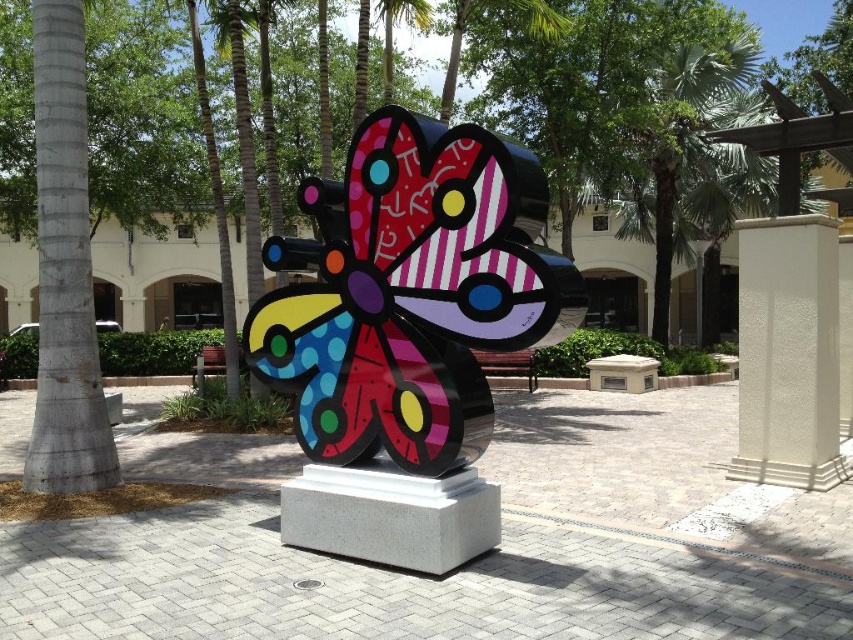
Question: Which of these objects is positioned closest to the smooth concrete pillar at left?

Choices:
 (A) metallic multicolored butterfly at center
 (B) green leafy palm tree at upper center
 (C) white textured pillar at center right

Answer: (A)

Question: Does metallic multicolored butterfly at center have a larger size compared to white textured pillar at center right?

Choices:
 (A) no
 (B) yes

Answer: (B)

Question: Is smooth concrete pillar at left wider than white textured pillar at center right?

Choices:
 (A) no
 (B) yes

Answer: (A)

Question: Is metallic multicolored butterfly at center smaller than white textured pillar at center right?

Choices:
 (A) no
 (B) yes

Answer: (A)

Question: Which point is closer to the camera?

Choices:
 (A) (421, 26)
 (B) (300, 292)
 (C) (776, 227)

Answer: (B)

Question: Which is farther from the metallic multicolored butterfly at center?

Choices:
 (A) smooth concrete pillar at left
 (B) green leafy palm tree at upper center
 (C) white textured pillar at center right

Answer: (B)